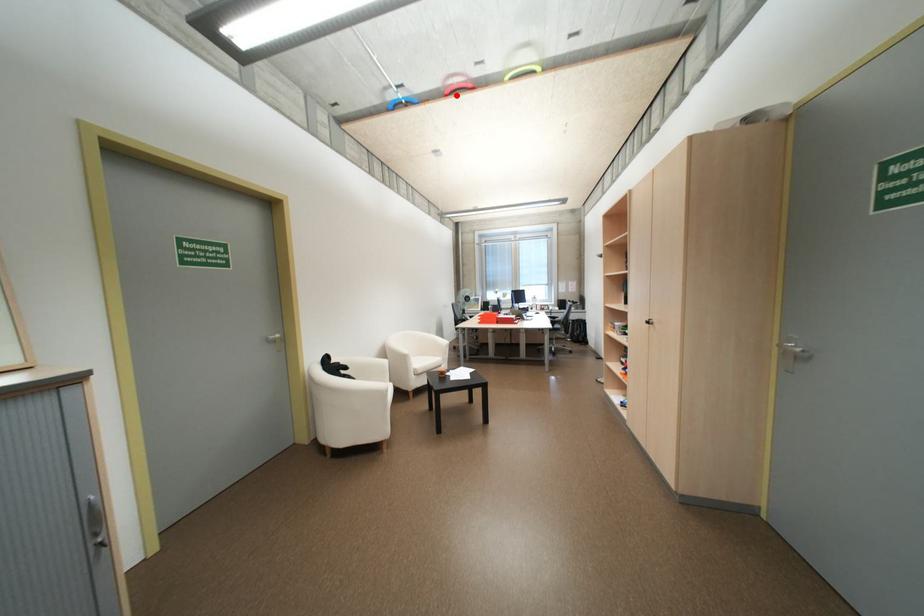
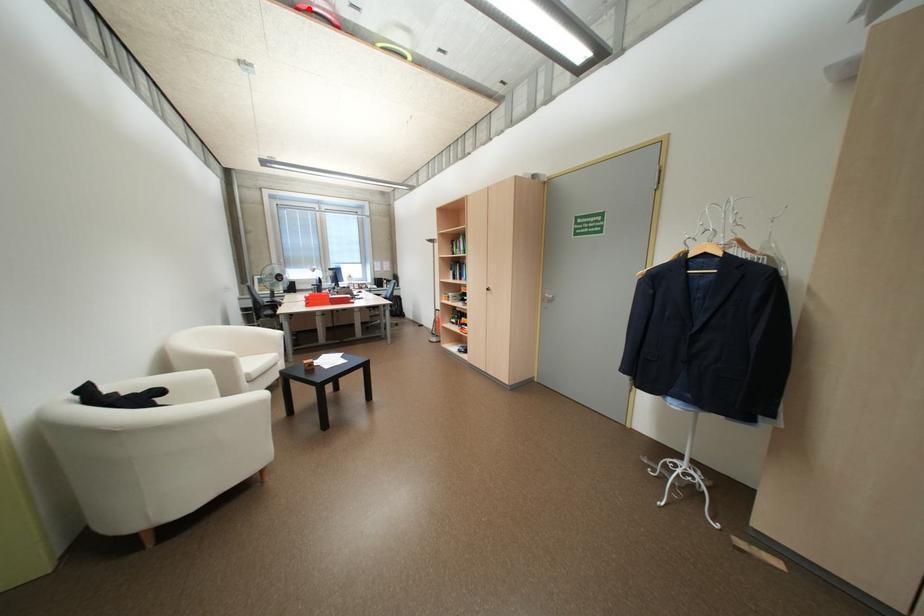
I am providing you with two images of the same scene from different viewpoints. A red point is marked on the first image and another point is marked on the second image. Does the point marked in image1 correspond to the same location as the one in image2?

Yes